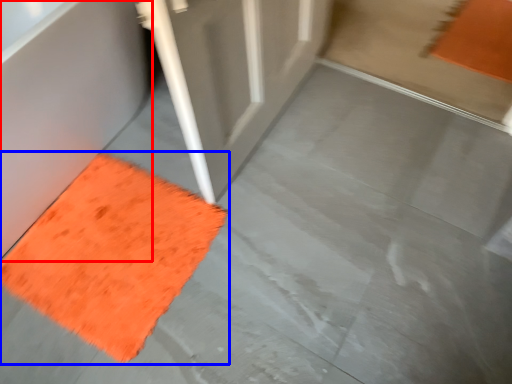
Question: Which of the following is the closest to the observer, bath (highlighted by a red box) or mat (highlighted by a blue box)?

Choices:
 (A) bath
 (B) mat

Answer: (A)